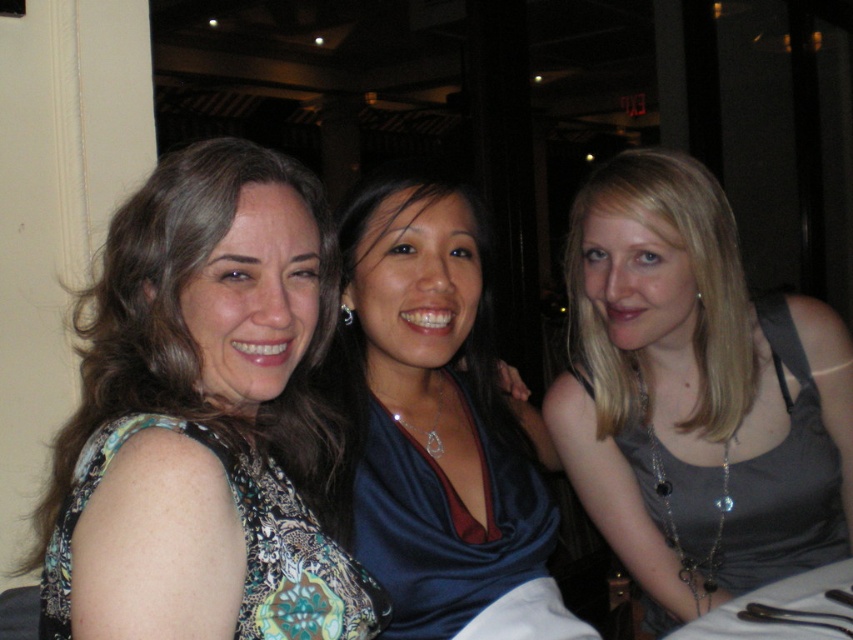
Which is more to the left, patterned fabric dress at center or blue satin dress at center?

patterned fabric dress at center

Is point (294, 480) positioned after point (357, 524)?

No, it is in front of (357, 524).

Identify the location of patterned fabric dress at center. (213, 388).

Who is positioned more to the right, gray fabric tank top at right or blue satin dress at center?

gray fabric tank top at right is more to the right.

Does gray fabric tank top at right have a larger size compared to blue satin dress at center?

Indeed, gray fabric tank top at right has a larger size compared to blue satin dress at center.

What do you see at coordinates (695, 394) in the screenshot? I see `gray fabric tank top at right` at bounding box center [695, 394].

Locate an element on the screen. The image size is (853, 640). gray fabric tank top at right is located at coordinates (695, 394).

Can you confirm if gray fabric tank top at right is taller than patterned fabric dress at center?

Yes.

Is point (659, 202) less distant than point (151, 291)?

No, (659, 202) is further to viewer.

Is point (717, 548) closer to viewer compared to point (318, 209)?

No, it is not.

Locate an element on the screen. gray fabric tank top at right is located at coordinates (695, 394).